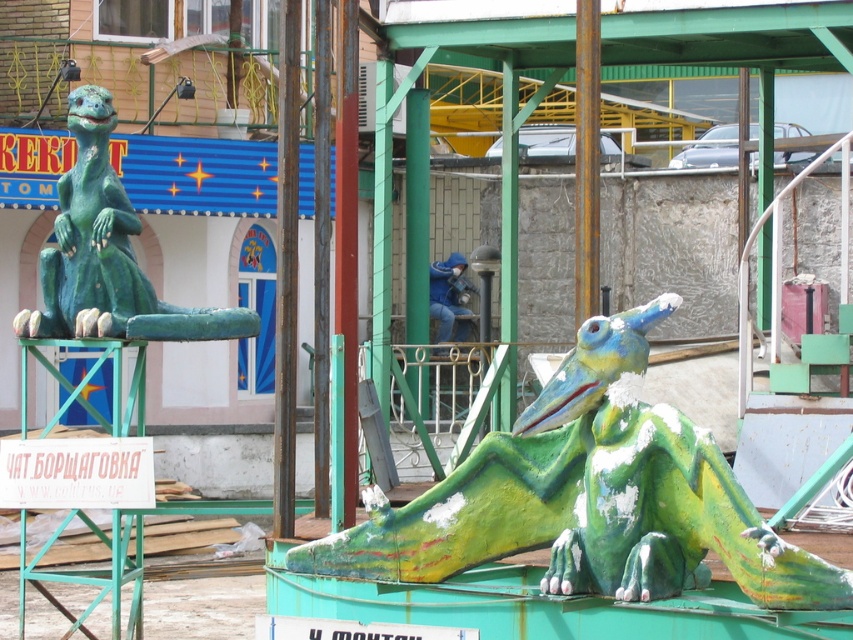
Question: Among these objects, which one is nearest to the camera?

Choices:
 (A) green painted wood dragon at left
 (B) metallic pole at center

Answer: (B)

Question: Does green painted wood dragon at left appear under metallic pole at center?

Choices:
 (A) no
 (B) yes

Answer: (B)

Question: Estimate the real-world distances between objects in this image. Which object is closer to the green matte dragon at center?

Choices:
 (A) green painted wood dragon at left
 (B) metallic pole at center

Answer: (B)

Question: Is metallic pole at center in front of rusty metal pole at center?

Choices:
 (A) yes
 (B) no

Answer: (B)

Question: Estimate the real-world distances between objects in this image. Which object is farther from the green painted wood dragon at left?

Choices:
 (A) metallic pole at center
 (B) rusty metal pole at center
 (C) green matte dragon at center

Answer: (C)

Question: Where is green matte dragon at center located in relation to green painted wood dragon at left in the image?

Choices:
 (A) above
 (B) below

Answer: (B)